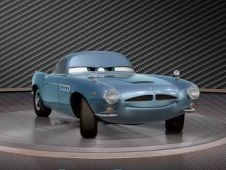
Find the location of a particular element. Image resolution: width=226 pixels, height=170 pixels. door is located at coordinates [x=65, y=89].